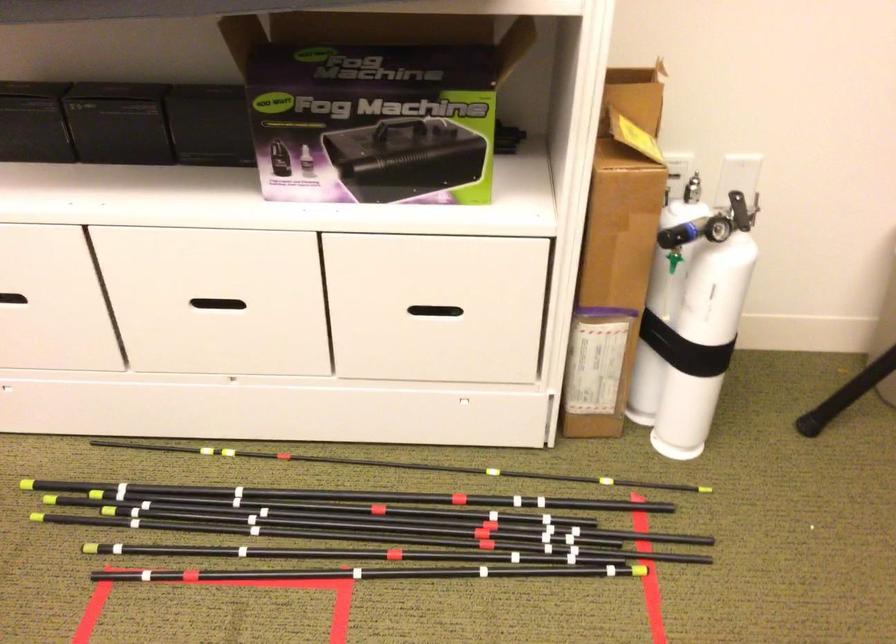
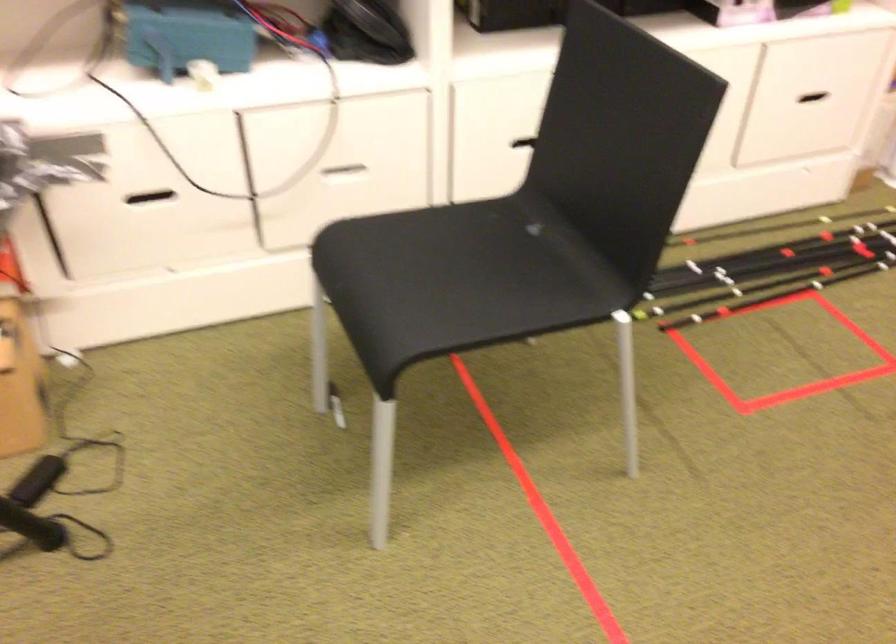
In the second image, find the point that corresponds to point (426, 321) in the first image.

(806, 102)